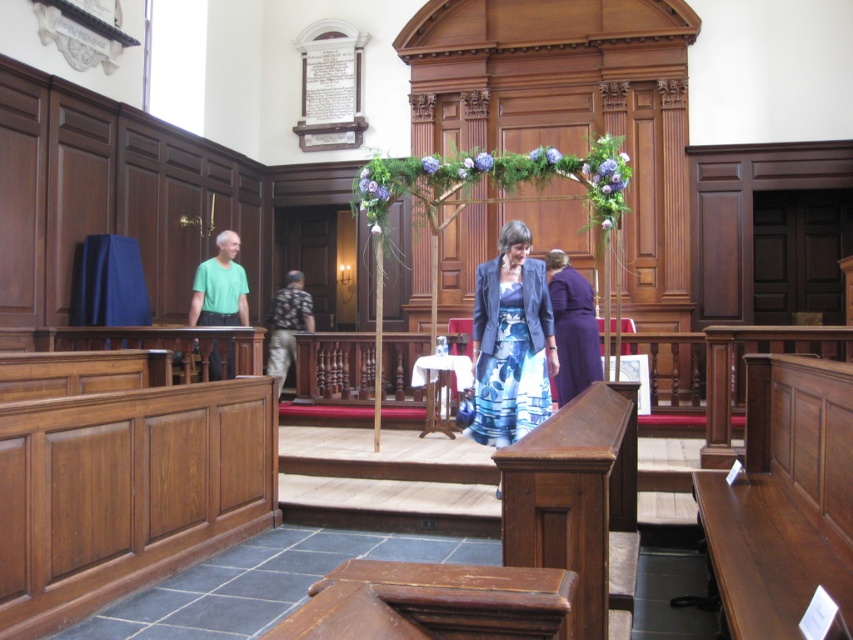
Between purple satin dress at center and floral-patterned fabric at center, which one is positioned lower?

Positioned lower is purple satin dress at center.

Is purple satin dress at center below floral-patterned fabric at center?

Indeed, purple satin dress at center is positioned under floral-patterned fabric at center.

Which is in front, point (563, 368) or point (306, 323)?

Point (563, 368)

This screenshot has width=853, height=640. I want to click on purple satin dress at center, so click(x=572, y=326).

Does purple satin dress at center appear over green matte t-shirt at left?

Incorrect, purple satin dress at center is not positioned above green matte t-shirt at left.

Who is more distant from viewer, (x=593, y=348) or (x=219, y=292)?

Positioned behind is point (x=219, y=292).

Find the location of a particular element. This screenshot has height=640, width=853. purple satin dress at center is located at coordinates (572, 326).

Is the position of blue floral dress at center less distant than that of green matte t-shirt at left?

That is True.

Which is behind, point (491, 403) or point (234, 323)?

Positioned behind is point (234, 323).

I want to click on blue floral dress at center, so click(511, 342).

Identify the location of blue floral dress at center. (511, 342).